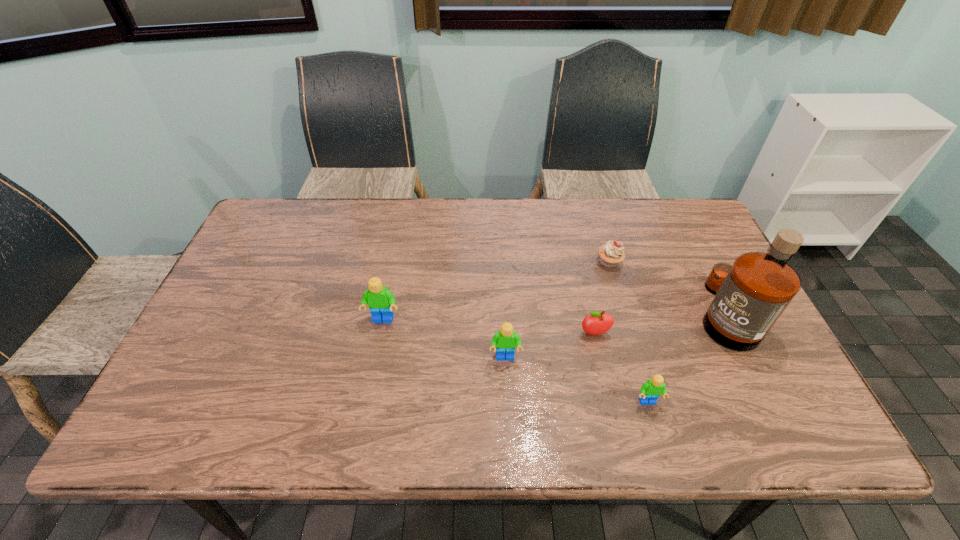
Please point a vacant point for placing a Lego on the left. Please provide its 2D coordinates. Your answer should be formatted as a tuple, i.e. [(x, y)], where the tuple contains the x and y coordinates of a point satisfying the conditions above.

[(276, 287)]